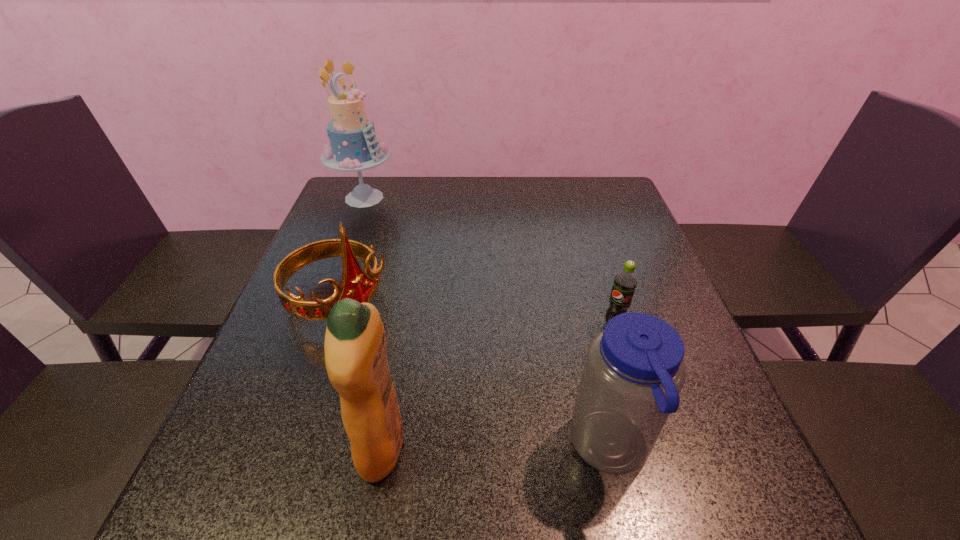
You are a GUI agent. You are given a task and a screenshot of the screen. Output one action in this format:
    pyautogui.click(x=<x>, y=<y>)
    Task: Click on the free spot on the desktop that is between the detergent and the water bottle and is positioned with a ladder on the side of the tallest object
    This screenshot has height=540, width=960.
    Given the screenshot: What is the action you would take?
    pyautogui.click(x=518, y=448)

The height and width of the screenshot is (540, 960). What are the coordinates of `free space on the desktop that is between the second tallest object and the water bottle and is positioned on the front label of the shortest object` in the screenshot? It's located at (486, 448).

Where is `vacant space on the desktop that is between the third object from right to left and the water bottle and is positioned on the front-facing side of the tiara`? The height and width of the screenshot is (540, 960). vacant space on the desktop that is between the third object from right to left and the water bottle and is positioned on the front-facing side of the tiara is located at coordinates (518, 448).